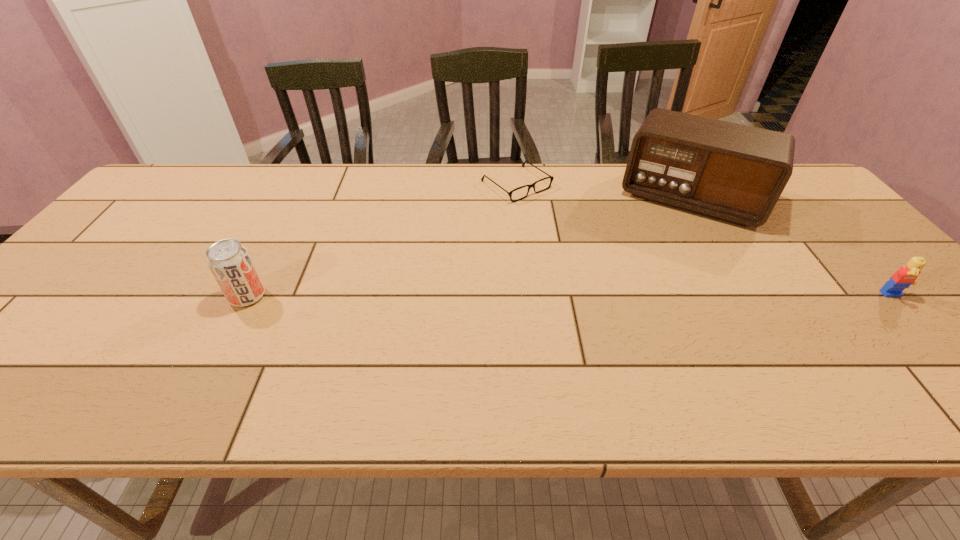
I want to click on vacant space at the near edge of the desktop, so click(622, 333).

The height and width of the screenshot is (540, 960). In the image, there is a desktop. Identify the location of vacant space at the left edge. (75, 282).

Where is `vacant region at the right edge of the desktop`? vacant region at the right edge of the desktop is located at coordinates (793, 232).

In the image, there is a desktop. At what (x,y) coordinates should I click in order to perform the action: click on vacant space at the far left corner. Please return your answer as a coordinate pair (x, y). Looking at the image, I should click on (202, 168).

Identify the location of vacant area between the leftmost object and the Lego. (570, 296).

The height and width of the screenshot is (540, 960). I want to click on free point between the shortest object and the Lego, so tap(705, 240).

At what (x,y) coordinates should I click in order to perform the action: click on empty space that is in between the leftmost object and the radio receiver. Please return your answer as a coordinate pair (x, y). This screenshot has height=540, width=960. Looking at the image, I should click on (469, 247).

Identify the location of vacant area that lies between the third object from right to left and the Lego. This screenshot has height=540, width=960. (705, 240).

Find the location of `vacant region between the soda can and the rightmost object`. vacant region between the soda can and the rightmost object is located at coordinates (570, 296).

You are a GUI agent. You are given a task and a screenshot of the screen. Output one action in this format:
    pyautogui.click(x=<x>, y=<y>)
    Task: Click on the free space between the shortest object and the third tallest object
    
    Given the screenshot: What is the action you would take?
    [x=705, y=240]